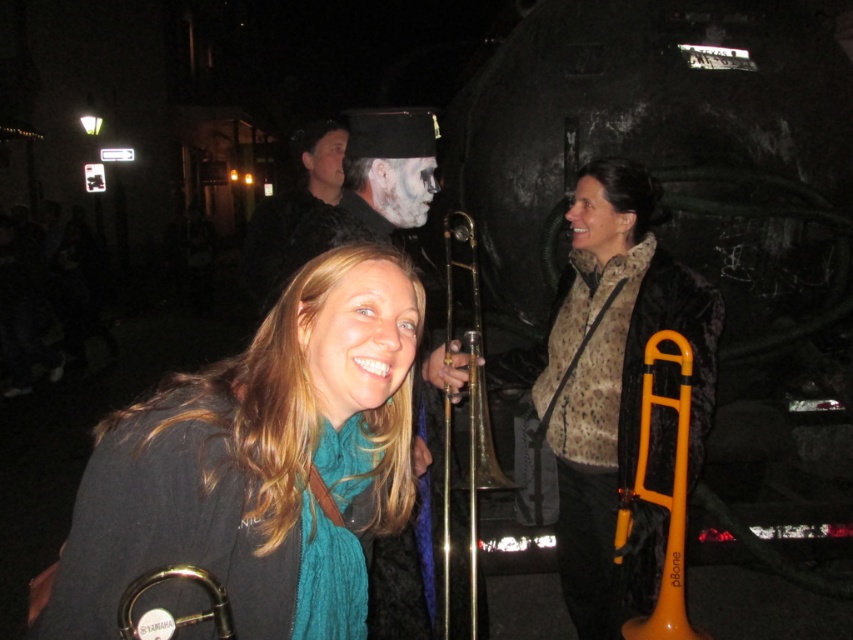
Question: Is gold brass trumpet at center closer to camera compared to orange plastic trombone at center?

Choices:
 (A) yes
 (B) no

Answer: (B)

Question: Can you confirm if matte black jacket at center is positioned below leopard print scarf at center?

Choices:
 (A) yes
 (B) no

Answer: (A)

Question: Which object appears farthest from the camera in this image?

Choices:
 (A) gold brass trumpet at center
 (B) matte black jacket at center
 (C) metallic gold trombone at center
 (D) matte black trombone at center

Answer: (C)

Question: Is matte black trombone at center smaller than gold brass trumpet at center?

Choices:
 (A) yes
 (B) no

Answer: (A)

Question: Which object is the farthest from the orange plastic trombone at center?

Choices:
 (A) matte black jacket at center
 (B) matte black trombone at center

Answer: (A)

Question: Which object appears closest to the camera in this image?

Choices:
 (A) leopard print scarf at center
 (B) matte black jacket at center

Answer: (B)